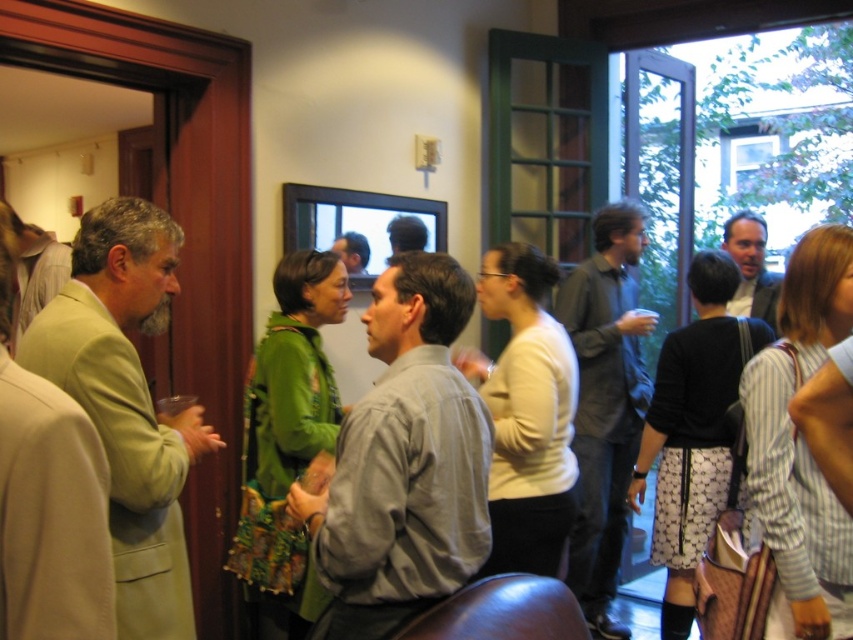
You are at the entrance of the room and want to find the gray cotton shirt at center. Based on the coordinates provided, in which direction should you look to locate it?

The gray cotton shirt at center is located at coordinates point (404, 461), so you should look towards the lower right direction from your position at the entrance to locate it.